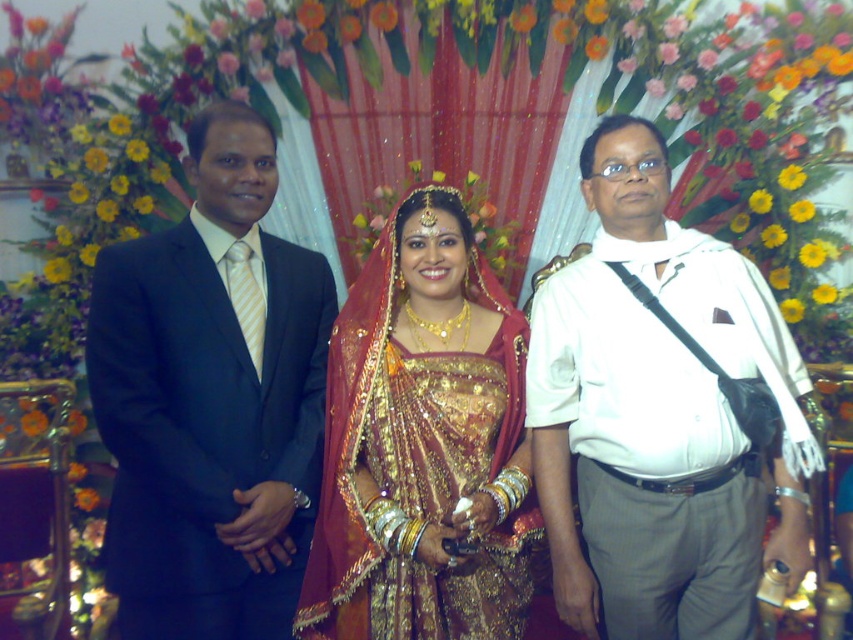
You are a photographer at the event and need to place a decorative flower arrangement. The flower arrangement must be placed at point (496, 468). According to the image, where exactly will the flower arrangement be placed?

The point (496, 468) is on the gold sequined dress at center, so the flower arrangement will be placed on the gold sequined dress at center.

Looking at this image, you are a photographer at the wedding. You want to capture a photo of the white glossy shirt at right and the matte black suit at left. Since the camera can only focus on one subject at a time, which one should you focus on first to ensure it appears sharp in the photo?

The white glossy shirt at right is in front of the matte black suit at left, so you should focus on the white glossy shirt at right first to ensure it appears sharp.

Based on the scene description, which object is taller between the gold sequined dress at center and the gold sequined saree at center?

The gold sequined dress at center is taller than the gold sequined saree at center according to the description.